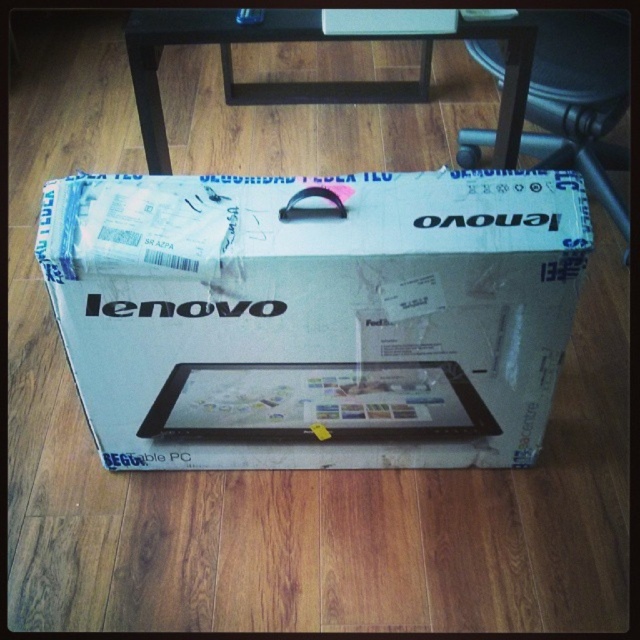
You are standing in front of a large Lenovo box for a tablet PC on a wooden floor. You see two points marked on the box at coordinates point [349,284] and point [561,122]. From your perspective, which point is closer to you?

Point [349,284] is in front of point [561,122], so it is closer to you.

You are organizing a tech exhibition and need to place the matte black tablet at center and the wooden stool at center on a display table. Based on their sizes, which object should you place first to ensure stability?

The wooden stool at center should be placed first because the matte black tablet at center is smaller and can be securely placed on top of it for stability.